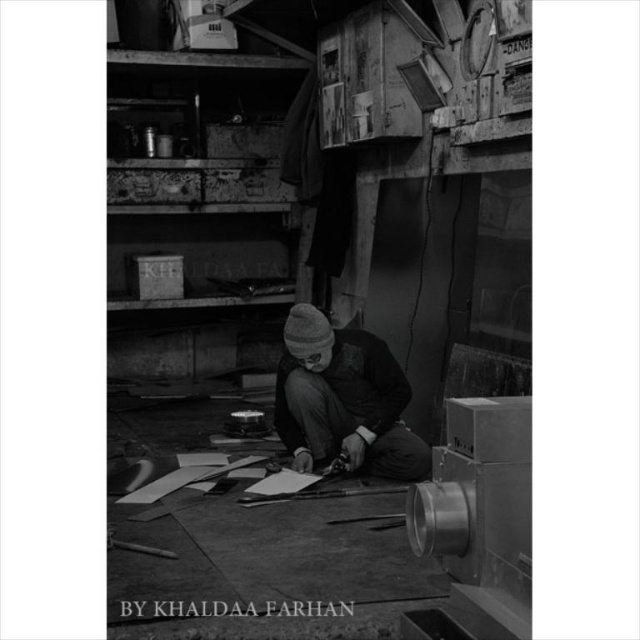
You are a photographer analyzing this image. You notice the metallic sheen scissors at center and the dark gray knit hat at center. Based on their positions, which object is closer to the camera?

The metallic sheen scissors at center are closer to the camera because they are positioned above the dark gray knit hat at center, indicating a higher placement in the visual plane.

You are trying to decide whether to place a small box between the metallic sheen scissors at center and the dark gray knit hat at center. Based on their sizes, will the box fit if the box is narrower than the scissors?

The metallic sheen scissors at center is wider than the dark gray knit hat at center. Since the box is narrower than the scissors, it should fit between them as long as the total width of the box is less than the distance between the two objects.

Based on the coordinates provided, where exactly is the metallic sheen scissors at center located in the image?

The metallic sheen scissors at center are located at the point with coordinates 0.439 on the x axis and 0.517 on the y axis.